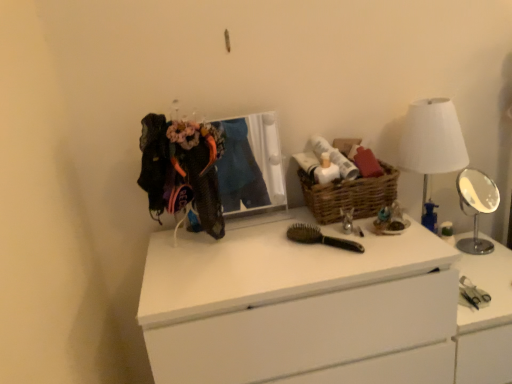
This screenshot has height=384, width=512. Find the location of `free space above white plastic vanity at right (from a real-world perspective)`. free space above white plastic vanity at right (from a real-world perspective) is located at coordinates (479, 270).